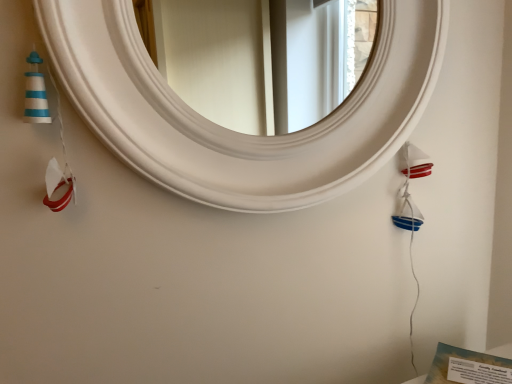
What do you see at coordinates (234, 131) in the screenshot? I see `white matte mirror at center` at bounding box center [234, 131].

Identify the location of white matte mirror at center. (234, 131).

At what (x,y) coordinates should I click in order to perform the action: click on white matte mirror at center. Please return your answer as a coordinate pair (x, y). Image resolution: width=512 pixels, height=384 pixels. Looking at the image, I should click on (234, 131).